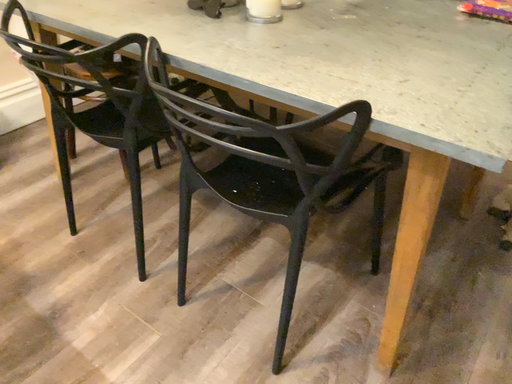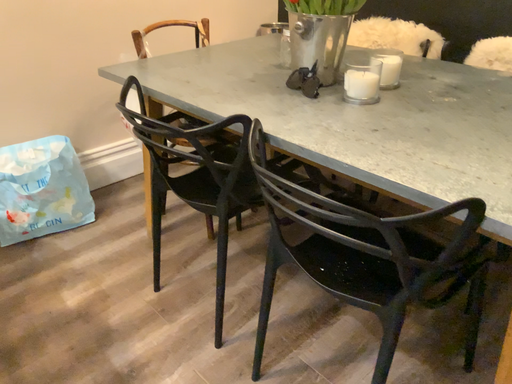
Question: How did the camera likely rotate when shooting the video?

Choices:
 (A) rotated downward
 (B) rotated upward

Answer: (B)